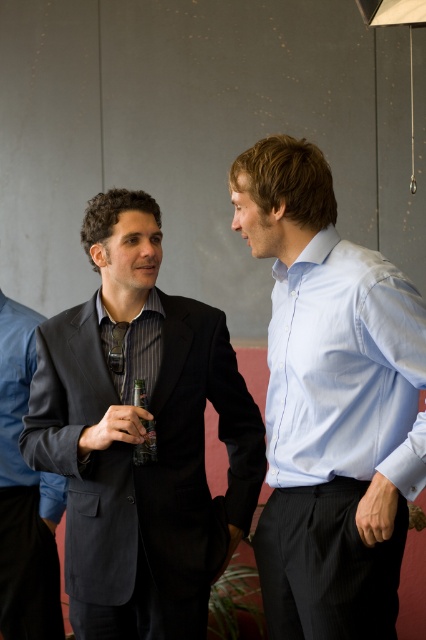
Measure the distance between point (195, 307) and camera.

They are 1.91 meters apart.

Does dark gray suit at left come behind black silk tie at center?

No, it is in front of black silk tie at center.

Is point (184, 328) farther from viewer compared to point (118, 333)?

Yes, point (184, 328) is behind point (118, 333).

The width and height of the screenshot is (426, 640). In order to click on dark gray suit at left in this screenshot , I will do `click(141, 436)`.

Can you confirm if dark gray suit at left is positioned above black glass bottle at center?

Yes, dark gray suit at left is above black glass bottle at center.

The width and height of the screenshot is (426, 640). What do you see at coordinates (141, 436) in the screenshot?
I see `dark gray suit at left` at bounding box center [141, 436].

This screenshot has height=640, width=426. Find the location of `dark gray suit at left`. dark gray suit at left is located at coordinates (x=141, y=436).

The height and width of the screenshot is (640, 426). Describe the element at coordinates (141, 436) in the screenshot. I see `dark gray suit at left` at that location.

Which is below, dark gray suit at left or light blue shirt at center?

dark gray suit at left is below.

Is point (114, 580) farther from camera compared to point (284, 592)?

That is True.

The height and width of the screenshot is (640, 426). I want to click on dark gray suit at left, so click(141, 436).